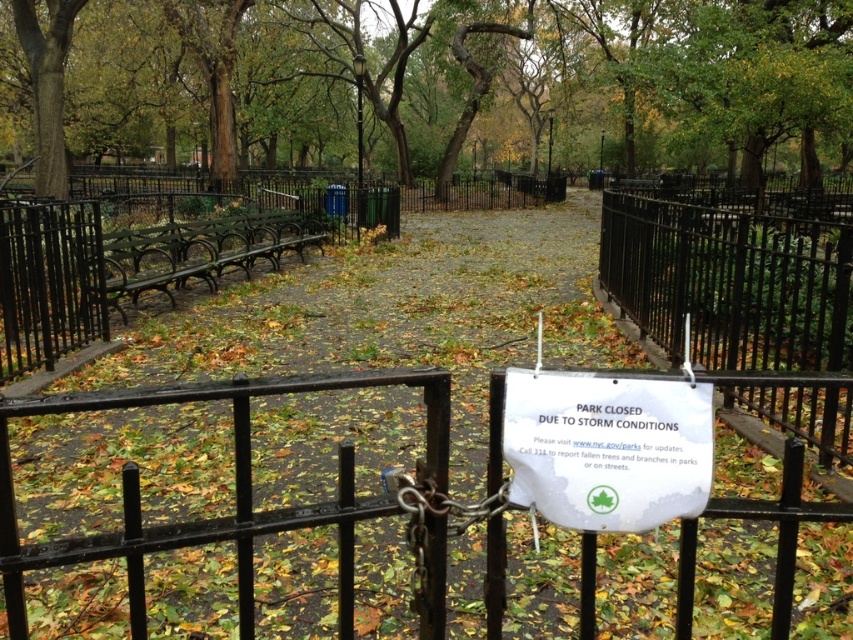
Can you confirm if black wrought iron fence at right is taller than white paper sign at center?

Yes, black wrought iron fence at right is taller than white paper sign at center.

Can you confirm if black wrought iron fence at right is positioned below white paper sign at center?

Actually, black wrought iron fence at right is above white paper sign at center.

Where is `black wrought iron fence at right`? Image resolution: width=853 pixels, height=640 pixels. black wrought iron fence at right is located at coordinates (730, 278).

Based on the photo, can you confirm if brown wood tree at center is smaller than black wrought iron fence at right?

Incorrect, brown wood tree at center is not smaller in size than black wrought iron fence at right.

Image resolution: width=853 pixels, height=640 pixels. What do you see at coordinates (427, 81) in the screenshot?
I see `brown wood tree at center` at bounding box center [427, 81].

Find the location of `brown wood tree at center`. brown wood tree at center is located at coordinates [427, 81].

Does black wrought iron gate at center have a smaller size compared to white paper sign at center?

No.

Can you confirm if black wrought iron gate at center is bigger than white paper sign at center?

Yes.

Between point (433, 456) and point (635, 522), which one is positioned behind?

The point (433, 456) is more distant.

Where is `black wrought iron gate at center`? black wrought iron gate at center is located at coordinates (235, 490).